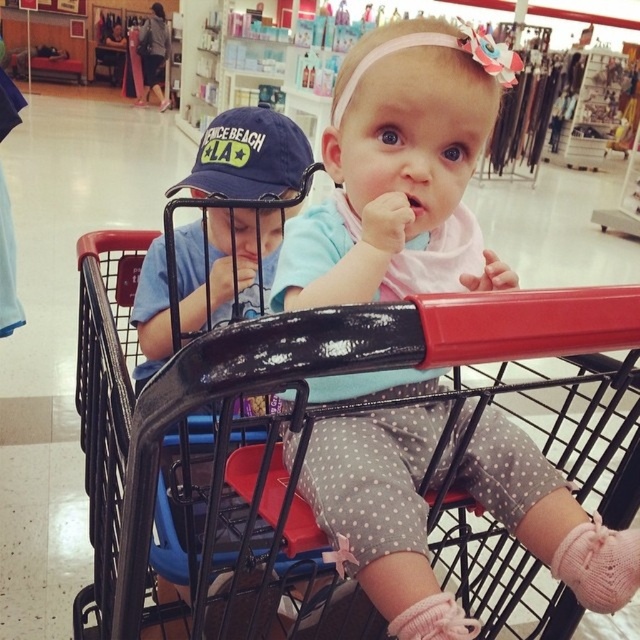
Question: Which object appears farthest from the camera in this image?

Choices:
 (A) polka dot leggings at center
 (B) blue cotton cap at upper left
 (C) black plastic shopping cart at center
 (D) blue fabric baseball cap at upper center

Answer: (D)

Question: Among these objects, which one is farthest from the camera?

Choices:
 (A) blue cotton cap at upper left
 (B) black plastic shopping cart at center
 (C) polka dot leggings at center
 (D) blue fabric baseball cap at upper center

Answer: (D)

Question: Estimate the real-world distances between objects in this image. Which object is closer to the black plastic shopping cart at center?

Choices:
 (A) blue cotton cap at upper left
 (B) blue fabric baseball cap at upper center
 (C) polka dot leggings at center

Answer: (C)

Question: Does polka dot leggings at center have a larger size compared to blue fabric baseball cap at upper center?

Choices:
 (A) no
 (B) yes

Answer: (B)

Question: Can you confirm if polka dot leggings at center is smaller than black plastic shopping cart at center?

Choices:
 (A) no
 (B) yes

Answer: (B)

Question: Can you confirm if blue cotton cap at upper left is wider than blue fabric baseball cap at upper center?

Choices:
 (A) no
 (B) yes

Answer: (B)